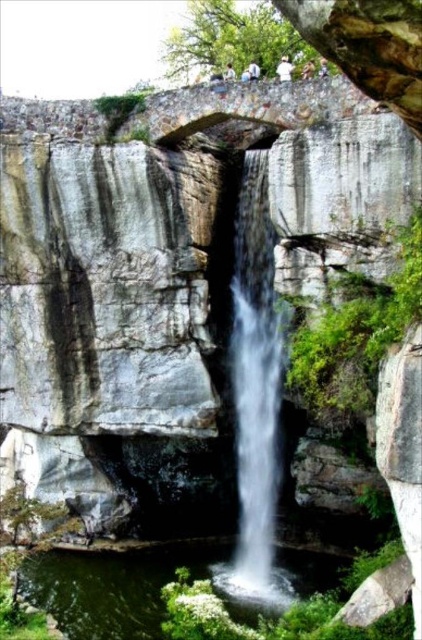
Question: Does white smooth waterfall at center lie behind clear water at center?

Choices:
 (A) yes
 (B) no

Answer: (A)

Question: Where is white smooth waterfall at center located in relation to clear water at center in the image?

Choices:
 (A) right
 (B) left

Answer: (A)

Question: Which point is farther from the camera taking this photo?

Choices:
 (A) (248, 186)
 (B) (99, 564)

Answer: (A)

Question: Is white smooth waterfall at center to the left of clear water at center from the viewer's perspective?

Choices:
 (A) no
 (B) yes

Answer: (A)